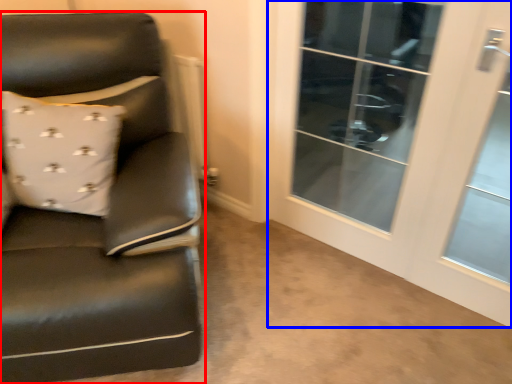
Question: Which object is closer to the camera taking this photo, chair (highlighted by a red box) or screen door (highlighted by a blue box)?

Choices:
 (A) chair
 (B) screen door

Answer: (A)